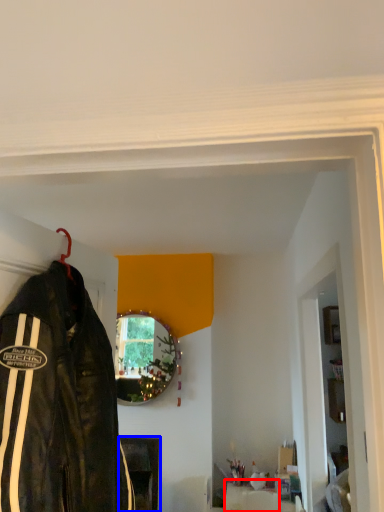
Question: Which object appears farthest to the camera in this image, furniture (highlighted by a red box) or furniture (highlighted by a blue box)?

Choices:
 (A) furniture
 (B) furniture

Answer: (B)